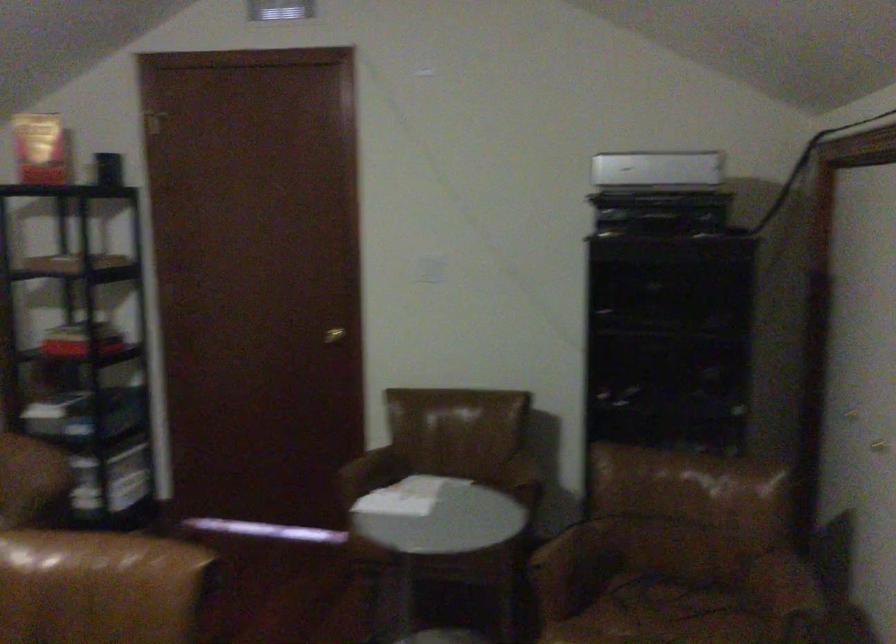
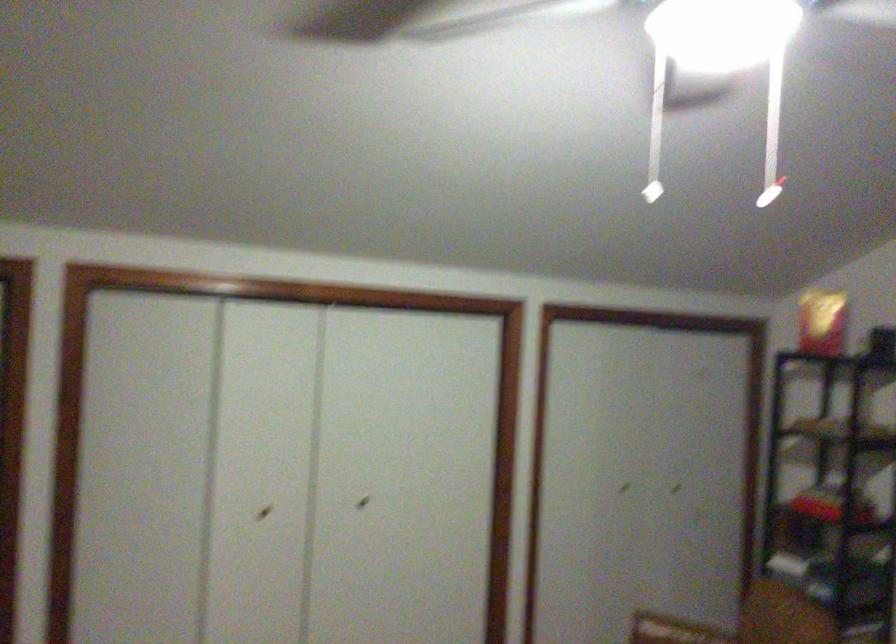
Question: The camera is either moving clockwise (left) or counter-clockwise (right) around the object. The first image is from the beginning of the video and the second image is from the end. Is the camera moving left or right when shooting the video?

Choices:
 (A) Left
 (B) Right

Answer: (B)